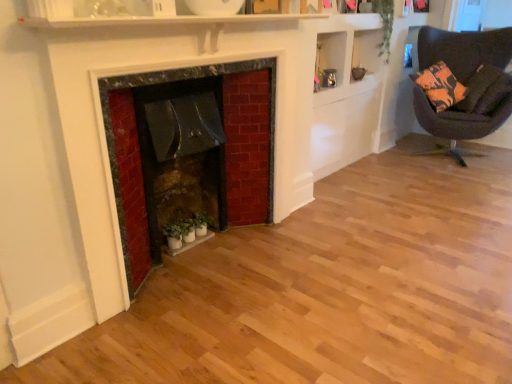
Question: Considering the relative sizes of dark brown fabric chair at right and green matte plant at lower center, which appears as the second plant when viewed from the right, in the image provided, is dark brown fabric chair at right thinner than green matte plant at lower center, which appears as the second plant when viewed from the right,?

Choices:
 (A) yes
 (B) no

Answer: (B)

Question: Is dark brown fabric chair at right outside of green matte plant at lower center, which appears as the second plant when viewed from the right?

Choices:
 (A) yes
 (B) no

Answer: (A)

Question: Considering the relative sizes of dark brown fabric chair at right and green matte plant at lower center, the 1th plant when ordered from front to back, in the image provided, is dark brown fabric chair at right taller than green matte plant at lower center, the 1th plant when ordered from front to back,?

Choices:
 (A) no
 (B) yes

Answer: (B)

Question: Could you tell me if dark brown fabric chair at right is facing green matte plant at lower center, the 1th plant when ordered from front to back?

Choices:
 (A) no
 (B) yes

Answer: (A)

Question: Is dark brown fabric chair at right further to camera compared to green matte plant at lower center, the 2th plant viewed from the top?

Choices:
 (A) yes
 (B) no

Answer: (A)

Question: Is dark brown fabric chair at right facing away from green matte plant at lower center, the second plant when ordered from back to front?

Choices:
 (A) no
 (B) yes

Answer: (A)

Question: Considering the relative sizes of green matte plant at lower center, which appears as the second plant when viewed from the right, and orange-patterned fabric pillow at upper right in the image provided, is green matte plant at lower center, which appears as the second plant when viewed from the right, shorter than orange-patterned fabric pillow at upper right?

Choices:
 (A) yes
 (B) no

Answer: (A)

Question: From the image's perspective, does green matte plant at lower center, the 2th plant viewed from the top, appear higher than orange-patterned fabric pillow at upper right?

Choices:
 (A) no
 (B) yes

Answer: (A)

Question: Would you say green matte plant at lower center, which is the first plant from bottom to top, is outside orange-patterned fabric pillow at upper right?

Choices:
 (A) yes
 (B) no

Answer: (A)

Question: Can you confirm if green matte plant at lower center, the first plant in the left-to-right sequence, is positioned to the left of orange-patterned fabric pillow at upper right?

Choices:
 (A) no
 (B) yes

Answer: (B)

Question: Considering the relative positions of green matte plant at lower center, the 2th plant viewed from the top, and orange-patterned fabric pillow at upper right in the image provided, is green matte plant at lower center, the 2th plant viewed from the top, behind orange-patterned fabric pillow at upper right?

Choices:
 (A) yes
 (B) no

Answer: (B)

Question: Does green matte plant at lower center, which appears as the second plant when viewed from the right, have a greater width compared to orange-patterned fabric pillow at upper right?

Choices:
 (A) no
 (B) yes

Answer: (A)

Question: Is rustic stone fireplace at center facing towards green matte plant at lower center, the second plant when ordered from back to front?

Choices:
 (A) yes
 (B) no

Answer: (A)